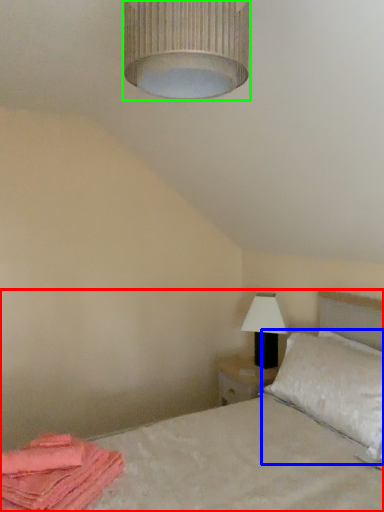
Question: Which object is positioned closest to bed (highlighted by a red box)? Select from pillow (highlighted by a blue box) and lamp (highlighted by a green box).

Choices:
 (A) pillow
 (B) lamp

Answer: (A)